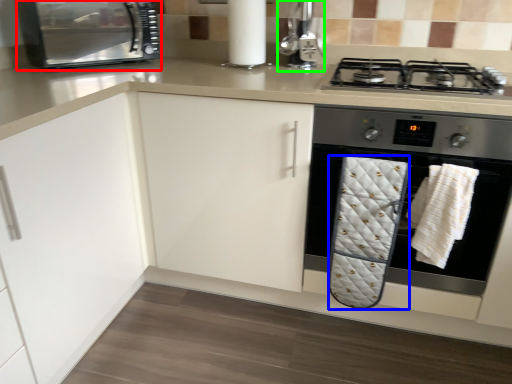
Question: Based on their relative distances, which object is nearer to kitchen appliance (highlighted by a red box)? Choose from bath towel (highlighted by a blue box) and coffee machine (highlighted by a green box).

Choices:
 (A) bath towel
 (B) coffee machine

Answer: (B)